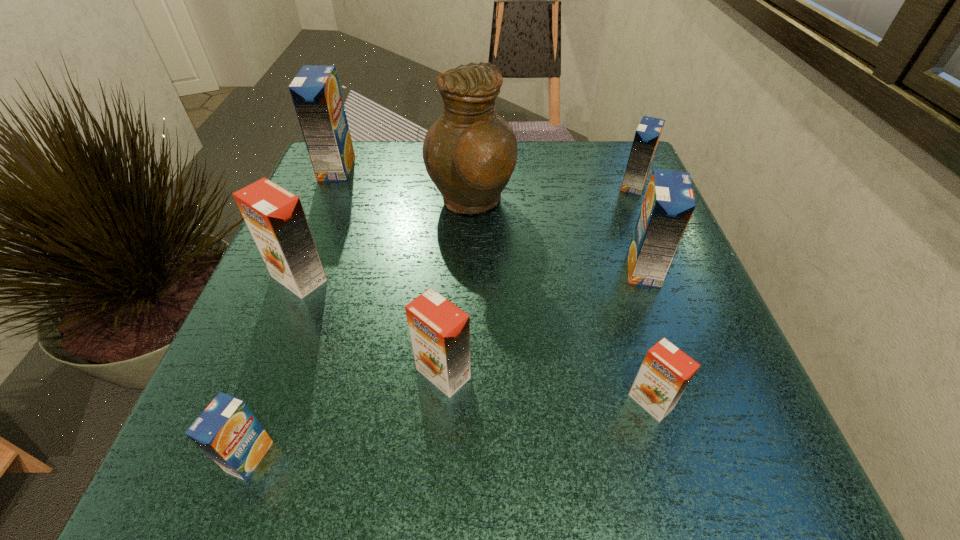
Where is `free space at the far right corner of the desktop`? The height and width of the screenshot is (540, 960). free space at the far right corner of the desktop is located at coordinates (577, 157).

At what (x,y) coordinates should I click in order to perform the action: click on free region at the near right corner of the desktop. Please return your answer as a coordinate pair (x, y). The width and height of the screenshot is (960, 540). Looking at the image, I should click on (688, 485).

Image resolution: width=960 pixels, height=540 pixels. I want to click on vacant space that is in between the second smallest orange orange juice and the tallest orange_juice, so click(x=390, y=271).

The width and height of the screenshot is (960, 540). What are the coordinates of `free area in between the fourth orange_juice from left to right and the third smallest blue orange_juice` in the screenshot? It's located at (543, 321).

At what (x,y) coordinates should I click in order to perform the action: click on empty space that is in between the second smallest orange orange juice and the pitcher. Please return your answer as a coordinate pair (x, y). This screenshot has height=540, width=960. Looking at the image, I should click on (457, 288).

Where is `unoccupied position between the tallest object and the nearest orange_juice`? The height and width of the screenshot is (540, 960). unoccupied position between the tallest object and the nearest orange_juice is located at coordinates (360, 330).

This screenshot has height=540, width=960. I want to click on free area in between the smallest orange orange juice and the third smallest blue orange_juice, so click(x=647, y=335).

Locate an element on the screen. The height and width of the screenshot is (540, 960). free space between the second smallest orange orange juice and the third smallest blue orange_juice is located at coordinates (543, 321).

At what (x,y) coordinates should I click in order to perform the action: click on free point between the rightmost orange orange juice and the pitcher. Please return your answer as a coordinate pair (x, y). This screenshot has height=540, width=960. Looking at the image, I should click on (561, 302).

You are a GUI agent. You are given a task and a screenshot of the screen. Output one action in this format:
    pyautogui.click(x=<x>, y=<y>)
    Task: Click on the empty space that is in between the second biggest orange orange juice and the tallest orange_juice
    The width and height of the screenshot is (960, 540).
    Given the screenshot: What is the action you would take?
    pyautogui.click(x=390, y=271)